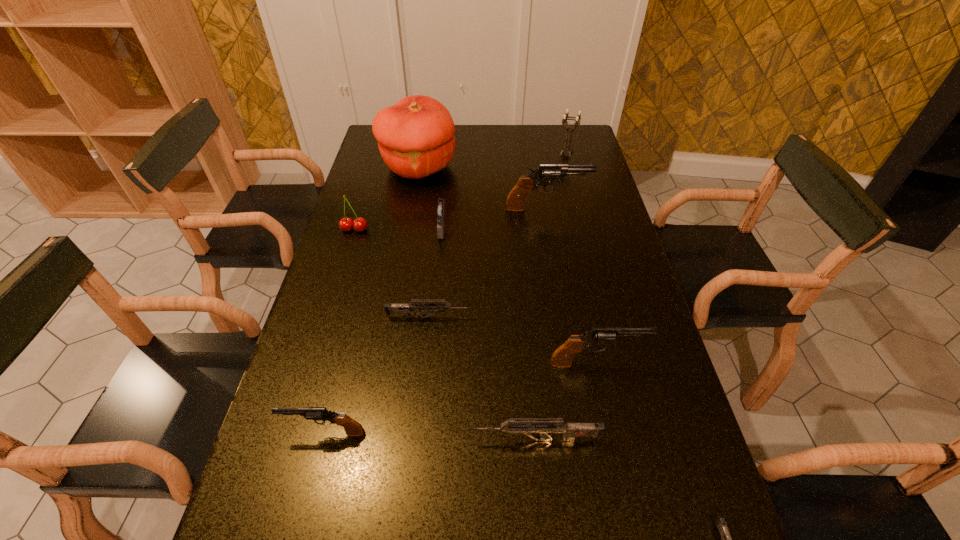
You are a GUI agent. You are given a task and a screenshot of the screen. Output one action in this format:
    pyautogui.click(x=<x>, y=<y>)
    Task: Click on the grey gun that is the second closest to the candle holder
    The image size is (960, 540).
    Given the screenshot: What is the action you would take?
    pyautogui.click(x=545, y=427)

Where is `grey gun that is the closest to the pumpkin`? The width and height of the screenshot is (960, 540). grey gun that is the closest to the pumpkin is located at coordinates (405, 309).

This screenshot has height=540, width=960. Identify the location of free space that satisfies the following two spatial constraints: 1. on the front side of the candle holder; 2. aimed along the barrel of the second gun from left to right. (609, 317).

Identify the location of free spot that satisfies the following two spatial constraints: 1. along the barrel of the third tallest gun; 2. on the right side of the igniter. (377, 228).

What are the coordinates of `free location that satisfies the following two spatial constraints: 1. along the barrel of the leftmost gun; 2. with the stems of the cherry pointing upwards` in the screenshot? It's located at (376, 230).

Identify the location of vacant position in the image that satisfies the following two spatial constraints: 1. along the barrel of the pumpkin; 2. on the right side of the leftmost gun. point(393,167).